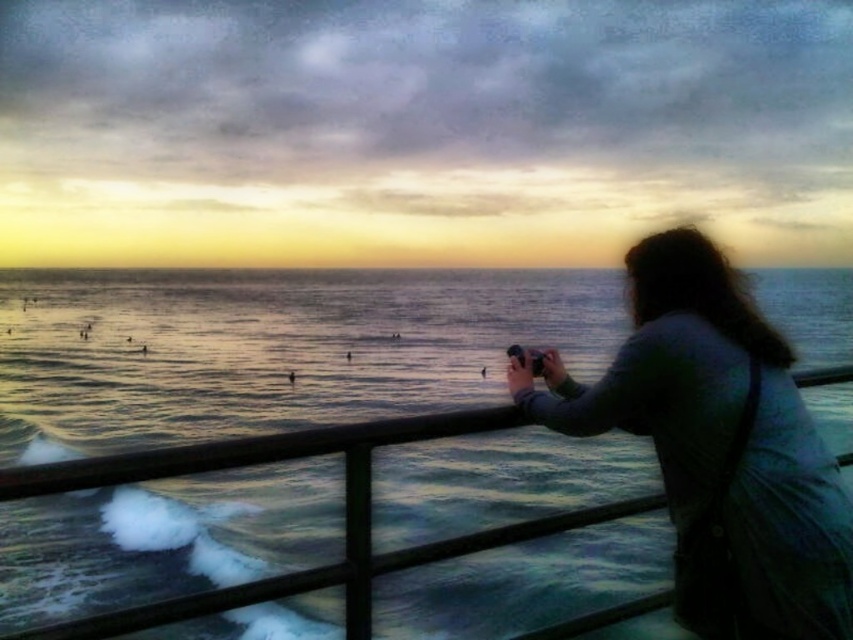
Between point (383, 344) and point (712, 298), which one is positioned in front?

Point (712, 298) is in front.

From the picture: Who is shorter, blue water at center or dark gray fabric jacket at right?

dark gray fabric jacket at right is shorter.

This screenshot has width=853, height=640. Describe the element at coordinates (271, 348) in the screenshot. I see `blue water at center` at that location.

What are the coordinates of `blue water at center` in the screenshot? It's located at (271, 348).